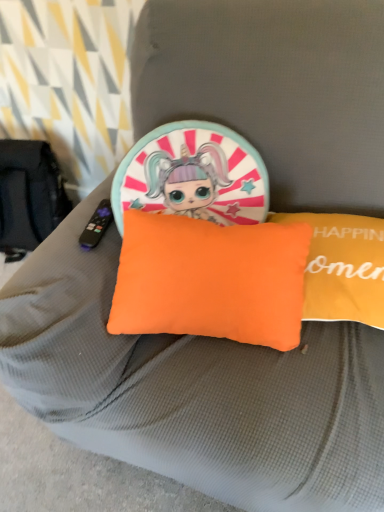
Question: Does orange fabric pillow at center, the second pillow when ordered from right to left, turn towards orange fabric pillow at center, the 2th pillow viewed from the left?

Choices:
 (A) yes
 (B) no

Answer: (B)

Question: Can you confirm if orange fabric pillow at center, the second pillow when ordered from right to left, is wider than orange fabric pillow at center, which is counted as the 1th pillow, starting from the right?

Choices:
 (A) yes
 (B) no

Answer: (B)

Question: From the image's perspective, is orange fabric pillow at center, marked as the first pillow in a left-to-right arrangement, beneath orange fabric pillow at center, the 2th pillow viewed from the left?

Choices:
 (A) yes
 (B) no

Answer: (A)

Question: Does orange fabric pillow at center, the second pillow when ordered from right to left, have a lesser width compared to orange fabric pillow at center, which is counted as the 1th pillow, starting from the right?

Choices:
 (A) no
 (B) yes

Answer: (B)

Question: Considering the relative positions of orange fabric pillow at center, marked as the first pillow in a left-to-right arrangement, and orange fabric pillow at center, which is counted as the 1th pillow, starting from the right, in the image provided, is orange fabric pillow at center, marked as the first pillow in a left-to-right arrangement, to the left of orange fabric pillow at center, which is counted as the 1th pillow, starting from the right, from the viewer's perspective?

Choices:
 (A) yes
 (B) no

Answer: (A)

Question: Is orange fabric pillow at center, marked as the first pillow in a left-to-right arrangement, bigger than orange fabric pillow at center, which is counted as the 1th pillow, starting from the right?

Choices:
 (A) no
 (B) yes

Answer: (B)

Question: Is orange fabric pillow at center, the 2th pillow viewed from the left, shorter than orange fabric pillow at center, marked as the first pillow in a left-to-right arrangement?

Choices:
 (A) no
 (B) yes

Answer: (B)

Question: From a real-world perspective, is orange fabric pillow at center, which is counted as the 1th pillow, starting from the right, located higher than orange fabric pillow at center, the second pillow when ordered from right to left?

Choices:
 (A) no
 (B) yes

Answer: (A)

Question: Is orange fabric pillow at center, which is counted as the 1th pillow, starting from the right, positioned before orange fabric pillow at center, the second pillow when ordered from right to left?

Choices:
 (A) no
 (B) yes

Answer: (A)

Question: Is orange fabric pillow at center, which is counted as the 1th pillow, starting from the right, positioned with its back to orange fabric pillow at center, the second pillow when ordered from right to left?

Choices:
 (A) yes
 (B) no

Answer: (B)

Question: Is orange fabric pillow at center, which is counted as the 1th pillow, starting from the right, facing towards orange fabric pillow at center, marked as the first pillow in a left-to-right arrangement?

Choices:
 (A) yes
 (B) no

Answer: (B)

Question: From the image's perspective, is orange fabric pillow at center, which is counted as the 1th pillow, starting from the right, below orange fabric pillow at center, the second pillow when ordered from right to left?

Choices:
 (A) no
 (B) yes

Answer: (A)

Question: From a real-world perspective, is orange fabric pillow at center, the 2th pillow viewed from the left, physically located above or below orange fabric pillow at center, marked as the first pillow in a left-to-right arrangement?

Choices:
 (A) below
 (B) above

Answer: (A)